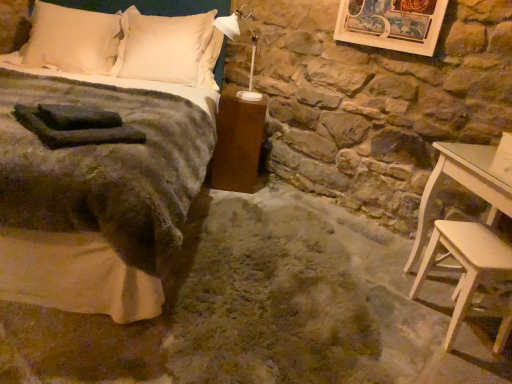
This screenshot has width=512, height=384. I want to click on vacant region above light beige wood stool at lower right (from a real-world perspective), so click(481, 244).